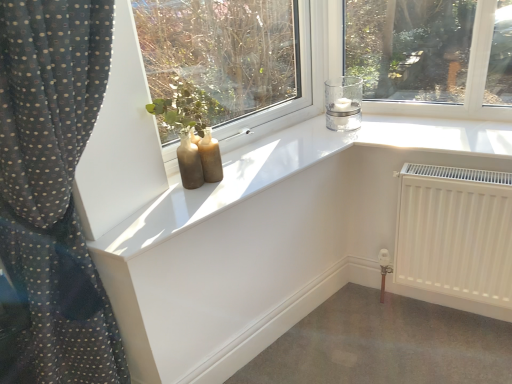
Question: Considering the positions of clear glass candle at upper right and matte glass bottles at center in the image, is clear glass candle at upper right wider or thinner than matte glass bottles at center?

Choices:
 (A) thin
 (B) wide

Answer: (B)

Question: In the image, is clear glass candle at upper right positioned in front of or behind matte glass bottles at center?

Choices:
 (A) behind
 (B) front

Answer: (A)

Question: Which object is positioned closest to the white matte radiator at lower right?

Choices:
 (A) matte glass bottles at center
 (B) clear glass candle at upper right

Answer: (B)

Question: Estimate the real-world distances between objects in this image. Which object is farther from the matte glass bottles at center?

Choices:
 (A) white matte radiator at lower right
 (B) clear glass candle at upper right

Answer: (A)